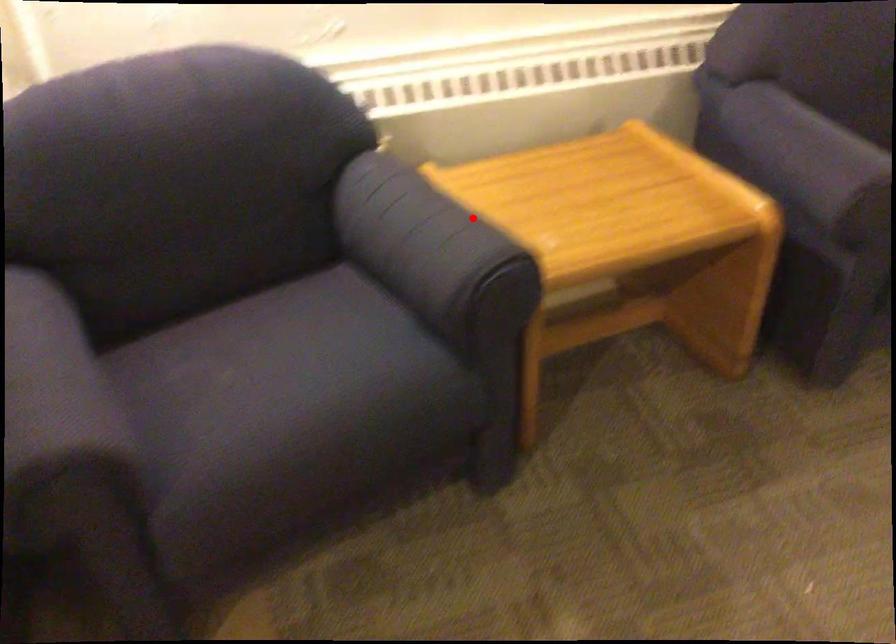
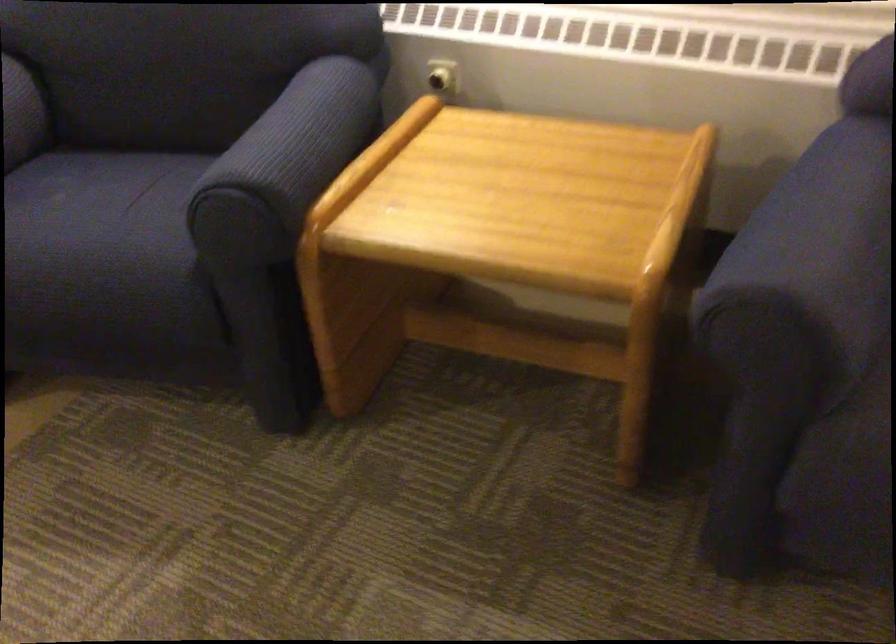
Where in the second image is the point corresponding to the highlighted location from the first image?

(295, 144)